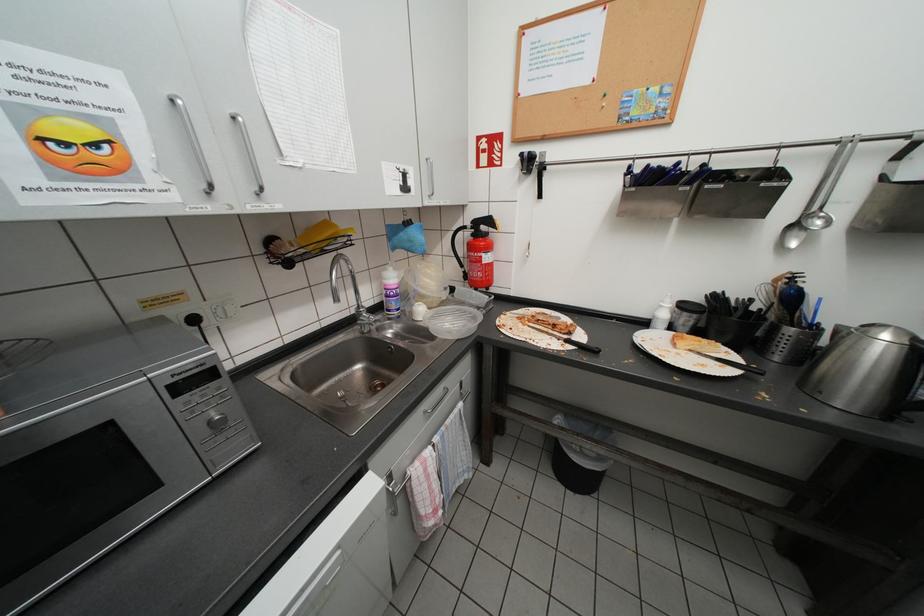
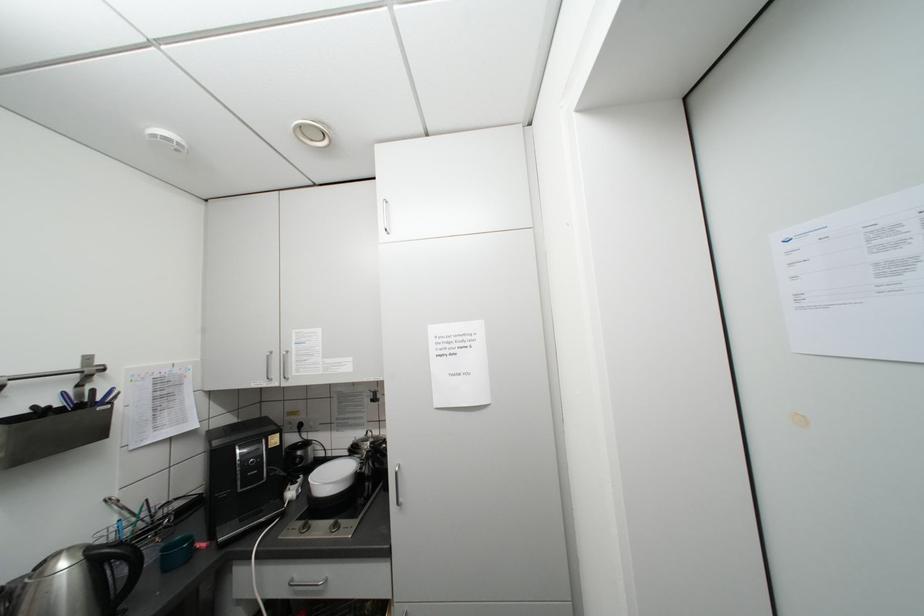
Question: The images are taken continuously from a first-person perspective. In which direction is your viewpoint rotating?

Choices:
 (A) Left
 (B) Right
 (C) Up
 (D) Down

Answer: (B)